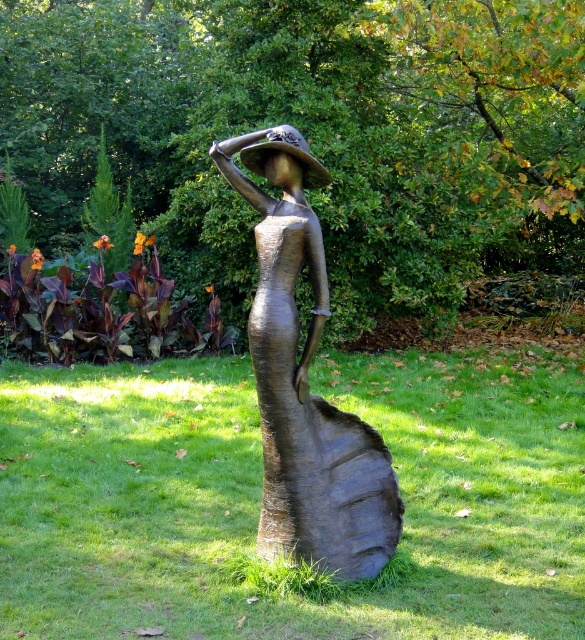
You are a gardener planning to mow the lawn around the bronze statue at center and the green grass at center. Which object should you mow first if you want to start closest to your current position?

The green grass at center should be mowed first since it is in front of the bronze statue at center, making it closer to your starting position.